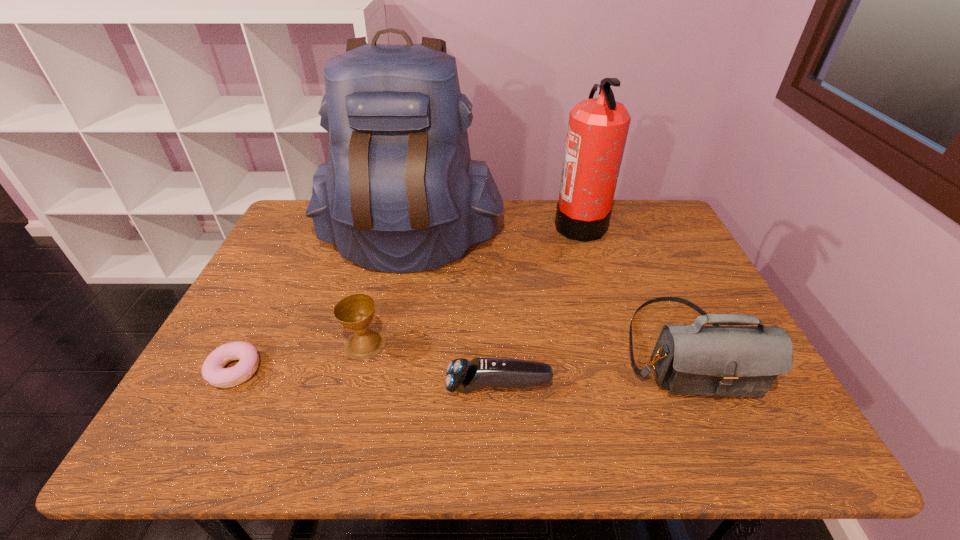
Locate an element on the screen. This screenshot has height=540, width=960. free spot between the fifth shortest object and the shortest object is located at coordinates (407, 297).

Where is `blank region between the fire extinguisher and the doughnut`? blank region between the fire extinguisher and the doughnut is located at coordinates (407, 297).

Where is `vacant space that is in between the fifth tallest object and the fifth shortest object`? vacant space that is in between the fifth tallest object and the fifth shortest object is located at coordinates (540, 305).

In order to click on vacant space that is in between the fifth tallest object and the doughnut in this screenshot , I will do coord(367,379).

Where is `the third closest object to the third tallest object`? The width and height of the screenshot is (960, 540). the third closest object to the third tallest object is located at coordinates (399, 193).

You are a GUI agent. You are given a task and a screenshot of the screen. Output one action in this format:
    pyautogui.click(x=<x>, y=<y>)
    Task: Click on the object that ranks as the third closest to the doughnut
    Image resolution: width=960 pixels, height=540 pixels.
    Given the screenshot: What is the action you would take?
    pyautogui.click(x=467, y=376)

The height and width of the screenshot is (540, 960). Identify the location of free space that satisfies the following two spatial constraints: 1. on the front side of the shoulder bag; 2. on the left side of the fifth shortest object. click(617, 348).

In order to click on blank area in the image that satisfies the following two spatial constraints: 1. on the front side of the fifth shortest object; 2. on the front side of the chalice in this screenshot , I will do click(616, 343).

Locate an element on the screen. This screenshot has width=960, height=540. free region that satisfies the following two spatial constraints: 1. on the front side of the second tallest object; 2. at the front pocket of the tallest object is located at coordinates 585,240.